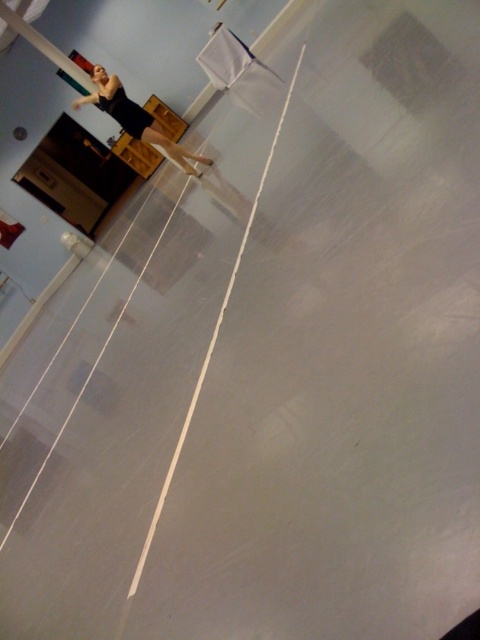
Question: Does black matte dress at upper left have a smaller size compared to metallic pole at upper left?

Choices:
 (A) yes
 (B) no

Answer: (B)

Question: Can you confirm if black matte dress at upper left is positioned to the left of metallic pole at upper left?

Choices:
 (A) no
 (B) yes

Answer: (A)

Question: Which point is closer to the camera?

Choices:
 (A) (61, 64)
 (B) (146, 140)

Answer: (B)

Question: Which point is closer to the camera taking this photo?

Choices:
 (A) (8, 13)
 (B) (93, 68)

Answer: (A)

Question: Is black matte dress at upper left smaller than metallic pole at upper left?

Choices:
 (A) no
 (B) yes

Answer: (A)

Question: Among these objects, which one is farthest from the camera?

Choices:
 (A) black matte dress at upper left
 (B) metallic pole at upper left

Answer: (B)